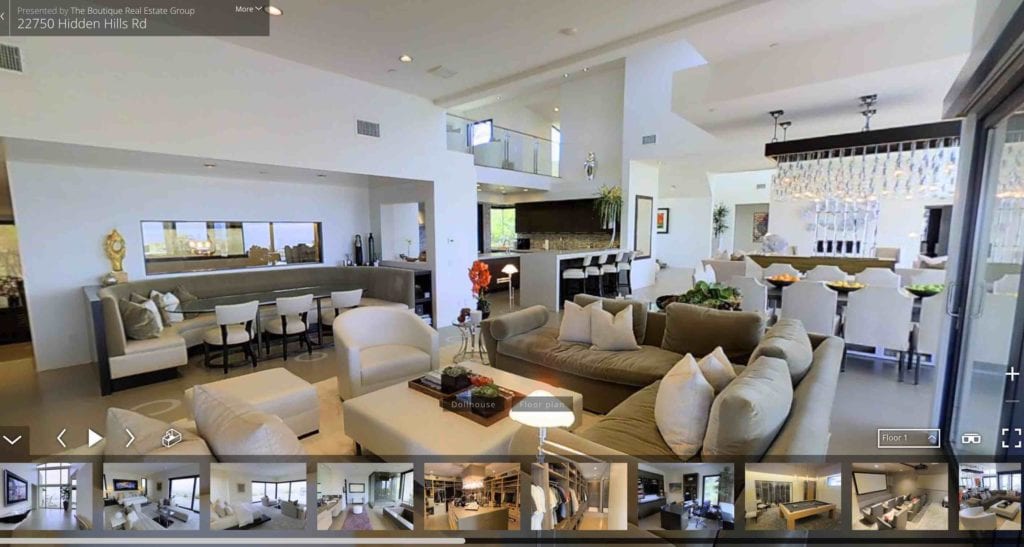
Identify the location of cusion ottoman. (432, 427).